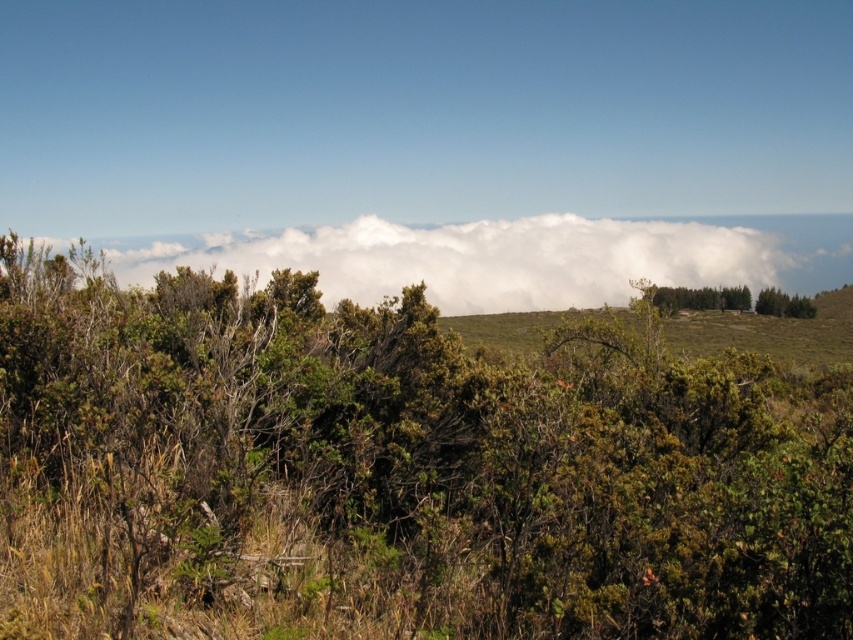
Which is more to the left, white fluffy cloud at upper center or green leafy tree at center?

Positioned to the left is white fluffy cloud at upper center.

Does point (604, 268) come behind point (668, 289)?

Yes, it is behind point (668, 289).

I want to click on white fluffy cloud at upper center, so click(x=503, y=257).

Who is taller, green leafy bush at center or white fluffy cloud at upper center?

Standing taller between the two is white fluffy cloud at upper center.

Who is more forward, (738,525) or (808,262)?

Point (738,525) is in front.

Measure the distance between green leafy bush at center and camera.

green leafy bush at center is 18.62 feet away from camera.

Where is `green leafy bush at center`? The width and height of the screenshot is (853, 640). green leafy bush at center is located at coordinates [x=399, y=470].

Can you confirm if green leafy bush at center is thinner than green leafy tree at center?

Yes.

Find the location of a particular element. green leafy bush at center is located at coordinates (399, 470).